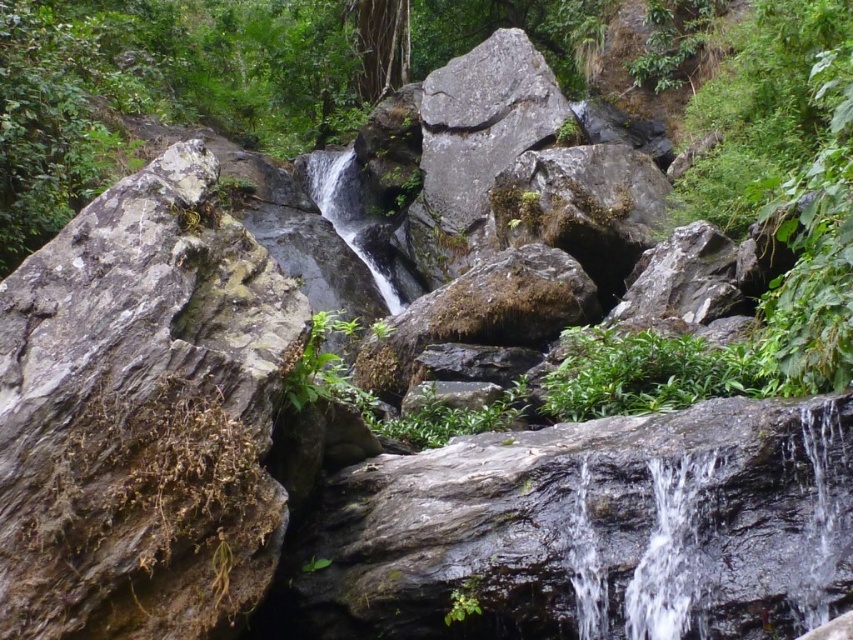
Question: Which of the following is the farthest from the observer?

Choices:
 (A) (675, 337)
 (B) (71, 465)

Answer: (A)

Question: Which of the following is the farthest from the observer?

Choices:
 (A) (276, 385)
 (B) (573, 401)

Answer: (B)

Question: Observing the image, what is the correct spatial positioning of rough gray rock at left in reference to green leafy plant at center?

Choices:
 (A) right
 (B) left

Answer: (B)

Question: Does rough gray rock at left lie behind green leafy plant at center?

Choices:
 (A) yes
 (B) no

Answer: (B)

Question: In this image, where is rough gray rock at left located relative to green leafy plant at center?

Choices:
 (A) below
 (B) above

Answer: (B)

Question: Which point is closer to the camera?

Choices:
 (A) (x=759, y=394)
 (B) (x=106, y=332)

Answer: (B)